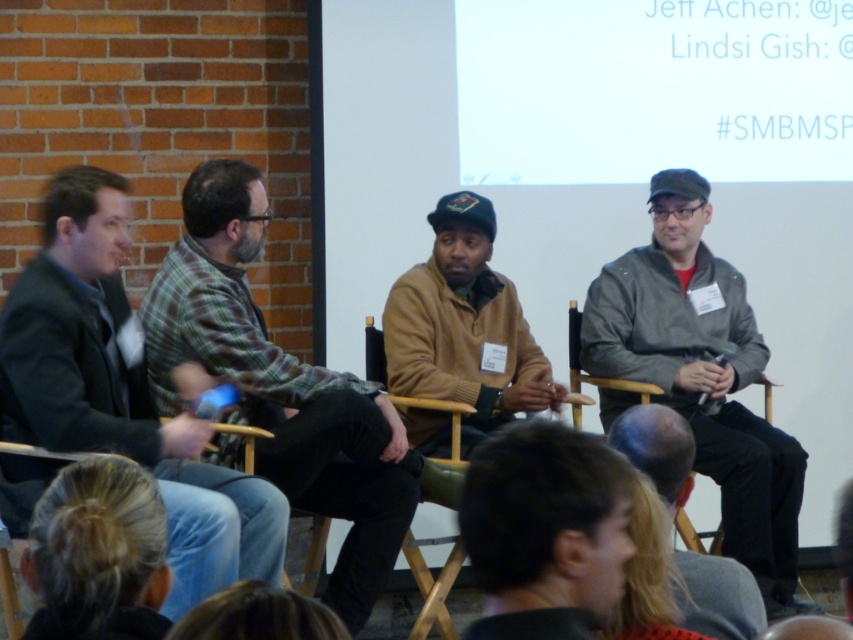
Between gray matte jacket at right and wooden chair at right, which one has less height?

With less height is wooden chair at right.

Who is taller, gray matte jacket at right or wooden chair at right?

With more height is gray matte jacket at right.

Does point (782, 476) come in front of point (573, 369)?

Yes.

Image resolution: width=853 pixels, height=640 pixels. What are the coordinates of `gray matte jacket at right` in the screenshot? It's located at (703, 376).

Is plaid fabric shirt at center to the left of blonde hair at lower left from the viewer's perspective?

No, plaid fabric shirt at center is not to the left of blonde hair at lower left.

Does point (223, 456) lie behind point (113, 554)?

Yes, point (223, 456) is farther from viewer.

Where is `plaid fabric shirt at center`? plaid fabric shirt at center is located at coordinates (285, 388).

The width and height of the screenshot is (853, 640). What do you see at coordinates (285, 388) in the screenshot?
I see `plaid fabric shirt at center` at bounding box center [285, 388].

Is point (309, 429) positioned after point (544, 483)?

Yes, it is behind point (544, 483).

Who is more forward, (322, 428) or (601, 532)?

Point (601, 532)

Identify the location of plaid fabric shirt at center. This screenshot has height=640, width=853. (285, 388).